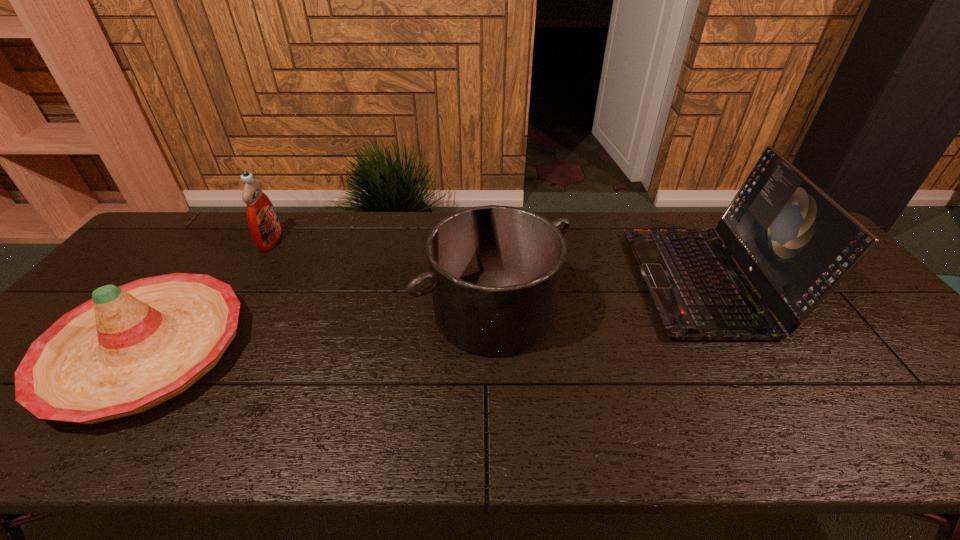
I want to click on the tallest object, so click(x=794, y=242).

Locate an element on the screen. The width and height of the screenshot is (960, 540). the rightmost object is located at coordinates (794, 242).

The image size is (960, 540). Find the location of `detergent`. detergent is located at coordinates (262, 219).

At what (x,y) coordinates should I click in order to perform the action: click on the second object from right to left. Please return your answer as a coordinate pair (x, y). The image size is (960, 540). Looking at the image, I should click on [x=495, y=271].

Identify the location of vacant area situated 0.290m on the screen of the rightmost object. The height and width of the screenshot is (540, 960). (540, 281).

The image size is (960, 540). I want to click on free space located on the screen of the rightmost object, so click(x=564, y=281).

Where is `vacant area situated 0.240m on the screen of the rightmost object`? vacant area situated 0.240m on the screen of the rightmost object is located at coordinates (557, 281).

Locate an element on the screen. This screenshot has height=540, width=960. vacant area located 0.100m on the front surface of the detergent is located at coordinates (311, 241).

Locate an element on the screen. free space located on the back of the pan is located at coordinates (492, 222).

Where is `laptop computer located at the far edge`? Image resolution: width=960 pixels, height=540 pixels. laptop computer located at the far edge is located at coordinates (794, 242).